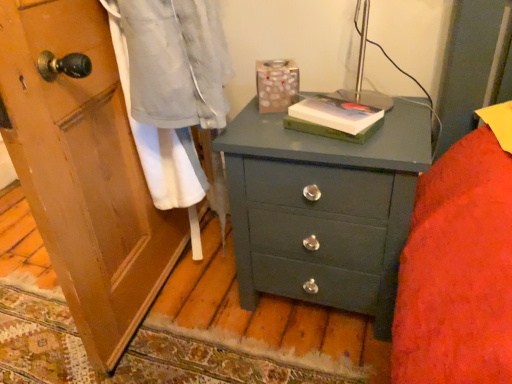
At what (x,y) coordinates should I click in order to perform the action: click on free spot to the right of hardcover book at center, acting as the 1th book starting from the top. Please return your answer as a coordinate pair (x, y). Image resolution: width=512 pixels, height=384 pixels. Looking at the image, I should click on (403, 118).